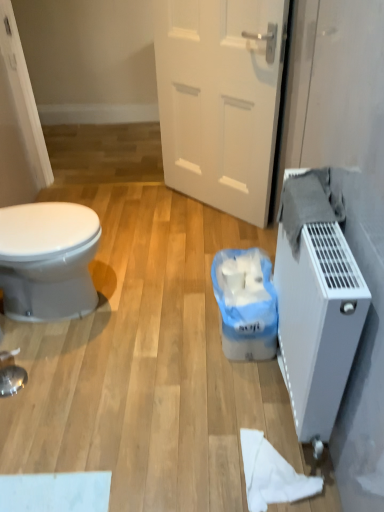
The width and height of the screenshot is (384, 512). I want to click on white plastic radiator at right, so click(x=316, y=310).

Considering the positions of objects white plastic bag at lower center and white matte door at center in the image provided, who is more to the left, white plastic bag at lower center or white matte door at center?

white matte door at center is more to the left.

Can you confirm if white plastic bag at lower center is wider than white matte door at center?

Yes.

Is white plastic bag at lower center next to white matte door at center and touching it?

No, white plastic bag at lower center is not making contact with white matte door at center.

Considering the sizes of white plastic bag at lower center and white matte door at center in the image, is white plastic bag at lower center taller or shorter than white matte door at center?

Clearly, white plastic bag at lower center is shorter compared to white matte door at center.

The width and height of the screenshot is (384, 512). Find the location of `door above the white matte toilet paper at lower right (from a real-world perspective)`. door above the white matte toilet paper at lower right (from a real-world perspective) is located at coordinates (220, 99).

Can you tell me how much white matte toilet paper at lower right and white matte door at center differ in facing direction?

white matte toilet paper at lower right and white matte door at center are facing 43 degrees away from each other.

Is white matte toilet paper at lower right positioned behind white matte door at center?

No.

Consider the image. Is white plastic bag at lower center at the back of white matte door at center?

No, white plastic bag at lower center is not at the back of white matte door at center.

Does white matte door at center have a greater height compared to white plastic bag at lower center?

Indeed, white matte door at center has a greater height compared to white plastic bag at lower center.

Is white matte door at center directly adjacent to white plastic bag at lower center?

No, white matte door at center is not in contact with white plastic bag at lower center.

Is white plastic bag at lower center positioned far away from white plastic radiator at right?

That's not correct — white plastic bag at lower center is a little close to white plastic radiator at right.

Which is closer, [235,322] or [299,407]?

Point [235,322] is positioned farther from the camera compared to point [299,407].

Where is `water heater that is above the white plastic bag at lower center (from a real-world perspective)`? The height and width of the screenshot is (512, 384). water heater that is above the white plastic bag at lower center (from a real-world perspective) is located at coordinates (316, 310).

Does white plastic bag at lower center turn towards white plastic radiator at right?

No, white plastic bag at lower center is not turned towards white plastic radiator at right.

Considering the sizes of objects white plastic bag at lower center and white matte toilet paper at lower right in the image provided, who is wider, white plastic bag at lower center or white matte toilet paper at lower right?

Wider between the two is white plastic bag at lower center.

Is white plastic bag at lower center closer to the viewer compared to white matte toilet paper at lower right?

No, white plastic bag at lower center is further to the viewer.

Is white plastic bag at lower center not within white matte toilet paper at lower right?

Indeed, white plastic bag at lower center is completely outside white matte toilet paper at lower right.

From the image's perspective, is white plastic bag at lower center positioned above or below white matte toilet paper at lower right?

Based on their image positions, white plastic bag at lower center is located above white matte toilet paper at lower right.

Is white plastic radiator at right far from white matte toilet paper at lower right?

That's not correct — white plastic radiator at right is a little close to white matte toilet paper at lower right.

Is white plastic radiator at right wider than white matte toilet paper at lower right?

Incorrect, the width of white plastic radiator at right does not surpass that of white matte toilet paper at lower right.

Is white plastic radiator at right facing towards white matte door at center?

No, white plastic radiator at right is not facing towards white matte door at center.

Does point (323, 356) appear closer or farther from the camera than point (270, 96)?

Point (323, 356) is positioned closer to the camera compared to point (270, 96).

Is white plastic radiator at right beside white matte door at center?

No, white plastic radiator at right is not with white matte door at center.

From the image's perspective, is white plastic radiator at right under white matte door at center?

Indeed, from the image's perspective, white plastic radiator at right is shown beneath white matte door at center.

Where is `garbage that appears below the white matte door at center (from a real-world perspective)`? This screenshot has height=512, width=384. garbage that appears below the white matte door at center (from a real-world perspective) is located at coordinates (245, 304).

I want to click on door located above the white matte toilet paper at lower right (from a real-world perspective), so click(x=220, y=99).

Looking at the image, which one is located further to white plastic radiator at right, white matte door at center or white plastic bag at lower center?

white matte door at center is further to white plastic radiator at right.

Based on their spatial positions, is white matte toilet paper at lower right or white plastic bag at lower center closer to white matte door at center?

white plastic bag at lower center lies closer to white matte door at center than the other object.

Looking at the image, which one is located further to white matte door at center, white plastic bag at lower center or white matte toilet paper at lower right?

Among the two, white matte toilet paper at lower right is located further to white matte door at center.

Considering their positions, is white plastic radiator at right positioned further to white matte toilet paper at lower right than white plastic bag at lower center?

white plastic bag at lower center is positioned further to the anchor white matte toilet paper at lower right.

Considering their positions, is white matte door at center positioned closer to white plastic bag at lower center than white matte toilet paper at lower right?

white matte toilet paper at lower right is closer to white plastic bag at lower center.

Which object lies nearer to the anchor point white plastic bag at lower center, white plastic radiator at right or white matte door at center?

white plastic radiator at right is closer to white plastic bag at lower center.

Based on their spatial positions, is white matte toilet paper at lower right or white matte door at center further from white plastic bag at lower center?

Based on the image, white matte door at center appears to be further to white plastic bag at lower center.

Which object lies nearer to the anchor point white matte door at center, white plastic radiator at right or white matte toilet paper at lower right?

white plastic radiator at right is positioned closer to the anchor white matte door at center.

Locate an element on the screen. The width and height of the screenshot is (384, 512). garbage between white matte door at center and white plastic radiator at right in the up-down direction is located at coordinates (245, 304).

This screenshot has height=512, width=384. What are the coordinates of `garbage between white matte door at center and white matte toilet paper at lower right from top to bottom` in the screenshot? It's located at (245, 304).

Identify the location of water heater between white matte door at center and white matte toilet paper at lower right in the up-down direction. (316, 310).

Locate an element on the screen. This screenshot has width=384, height=512. toilet paper located between white plastic radiator at right and white plastic bag at lower center in the depth direction is located at coordinates (272, 474).